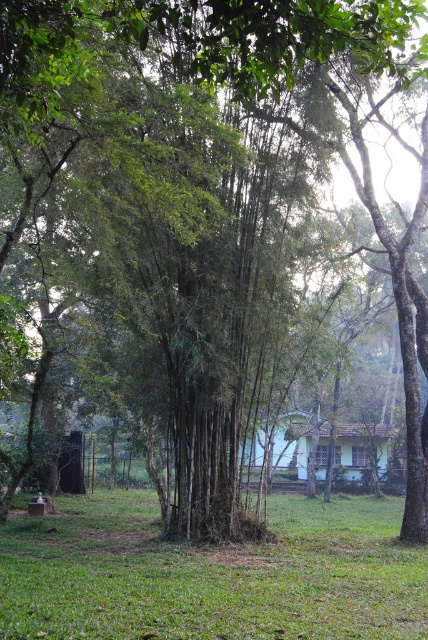
Does green grassy at lower center have a greater height compared to light green wooden hut at center?

No.

In the scene shown: Which is above, green grassy at lower center or light green wooden hut at center?

Positioned higher is light green wooden hut at center.

Which is in front, point (291, 547) or point (276, 456)?

Point (291, 547) is more forward.

Locate an element on the screen. The height and width of the screenshot is (640, 428). green grassy at lower center is located at coordinates (211, 573).